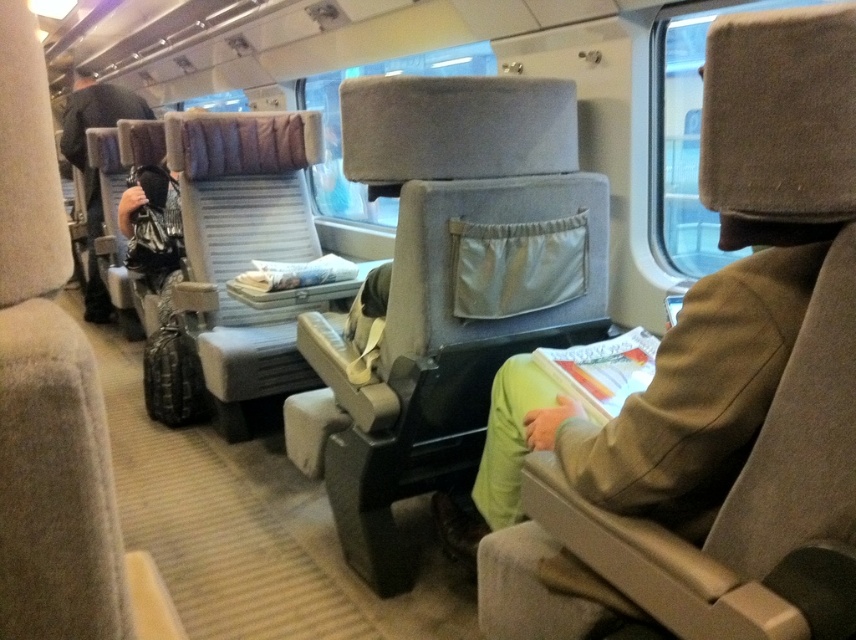
Does matte gray seat at center have a greater height compared to matte black backpack at left?

No.

Is matte gray seat at center above matte black backpack at left?

Actually, matte gray seat at center is below matte black backpack at left.

Does point (62, 492) come farther from viewer compared to point (88, 112)?

No, (62, 492) is in front of (88, 112).

The image size is (856, 640). In order to click on matte gray seat at center in this screenshot , I will do `click(52, 401)`.

Between light brown fabric jacket at center and matte black backpack at left, which one is positioned higher?

matte black backpack at left is higher up.

Who is lower down, light brown fabric jacket at center or matte black backpack at left?

light brown fabric jacket at center

Who is more distant from viewer, (759, 374) or (98, 304)?

The point (98, 304) is behind.

Locate an element on the screen. The height and width of the screenshot is (640, 856). light brown fabric jacket at center is located at coordinates (655, 404).

Does gray fabric chair at center appear on the left side of light brown fabric jacket at center?

Correct, you'll find gray fabric chair at center to the left of light brown fabric jacket at center.

The width and height of the screenshot is (856, 640). Find the location of `gray fabric chair at center`. gray fabric chair at center is located at coordinates (449, 289).